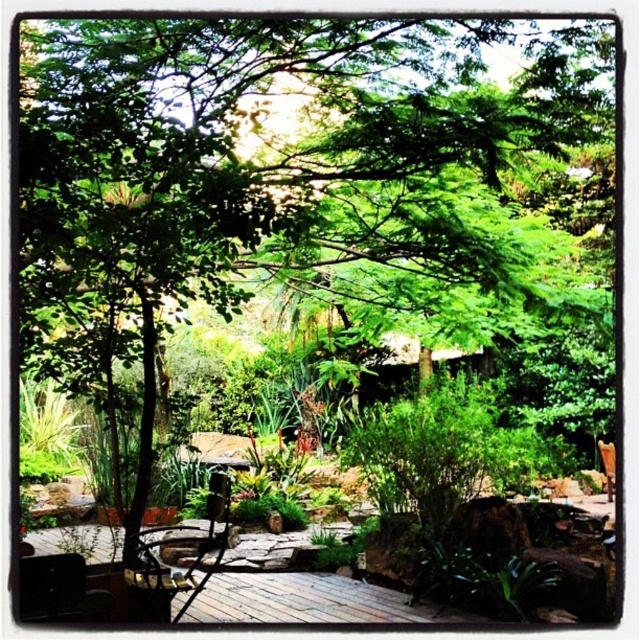
Is metallic silver chair at center smaller than brown wooden chair at lower right?

No, metallic silver chair at center is not smaller than brown wooden chair at lower right.

Who is taller, metallic silver chair at center or brown wooden chair at lower right?

metallic silver chair at center is taller.

You are a GUI agent. You are given a task and a screenshot of the screen. Output one action in this format:
    pyautogui.click(x=<x>, y=<y>)
    Task: Click on the metallic silver chair at center
    Image resolution: width=640 pixels, height=640 pixels.
    Given the screenshot: What is the action you would take?
    pyautogui.click(x=177, y=547)

Is matte black chair at lower left smaller than brown wooden chair at lower right?

Incorrect, matte black chair at lower left is not smaller in size than brown wooden chair at lower right.

Between point (70, 609) and point (605, 444), which one is positioned in front?

Point (70, 609)

Where is `matte black chair at lower left`? The image size is (640, 640). matte black chair at lower left is located at coordinates (60, 589).

Is metallic silver chair at center bigger than matte black chair at lower left?

Correct, metallic silver chair at center is larger in size than matte black chair at lower left.

What do you see at coordinates (177, 547) in the screenshot? I see `metallic silver chair at center` at bounding box center [177, 547].

At what (x,y) coordinates should I click in order to perform the action: click on metallic silver chair at center. Please return your answer as a coordinate pair (x, y). The width and height of the screenshot is (640, 640). Looking at the image, I should click on (177, 547).